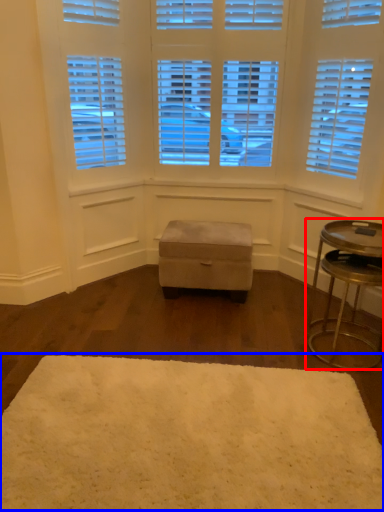
Question: Which object appears closest to the camera in this image, table (highlighted by a red box) or mat (highlighted by a blue box)?

Choices:
 (A) table
 (B) mat

Answer: (B)